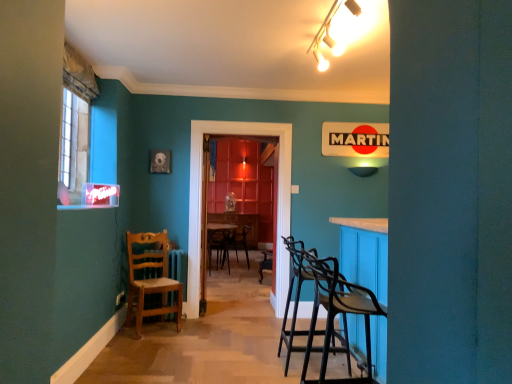
The width and height of the screenshot is (512, 384). In order to click on vacant space to the right of wooden chair at left in this screenshot , I will do `click(195, 326)`.